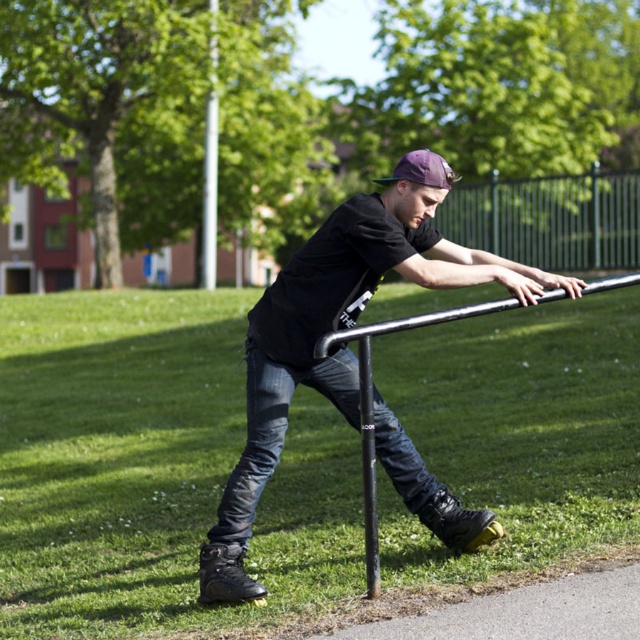
You are a photographer positioned at point 0.5, 0.5 in the image coordinate system. You want to capture a closeup shot of the black matte skateboard at center. Which direction should you move your camera to get the skateboard into the frame?

The black matte skateboard at center is located at point [339,328]. Since your current position is at [320,320], you should move your camera slightly to the right and upward to align with the skateboard.

You are a photographer trying to capture the perfect shot of the jeans at center and the polished metal pole at center. If you want to ensure both objects are in focus, which one should you adjust your camera focus on first?

The jeans at center are wider than the polished metal pole at center, so you should focus on the jeans at center first to ensure proper depth of field.